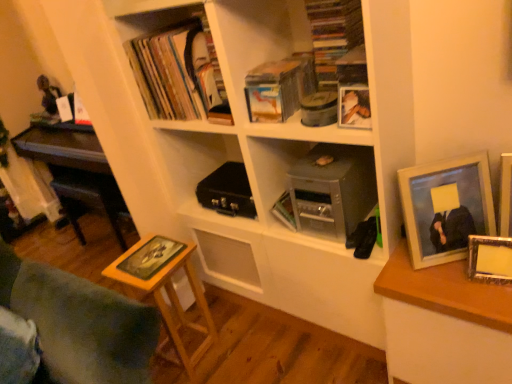
At what (x,y) coordinates should I click in order to perform the action: click on free space above hardcover book at upper center (from a real-world perspective). Please return your answer as a coordinate pair (x, y). This screenshot has width=512, height=384. Looking at the image, I should click on (273, 67).